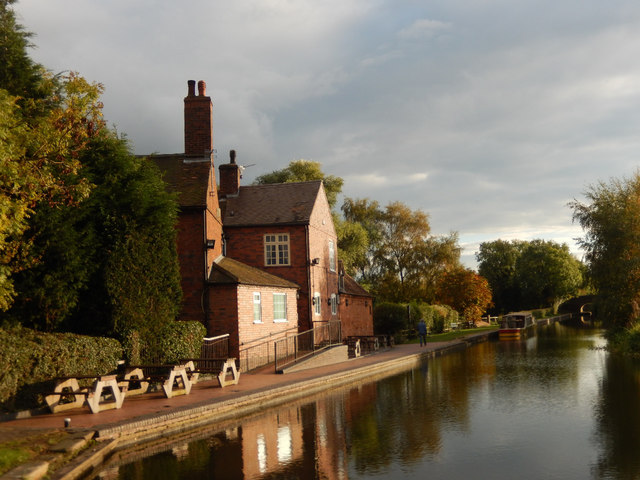
Locate an element on the screen. This screenshot has width=640, height=480. chimney is located at coordinates (193, 114), (228, 178).